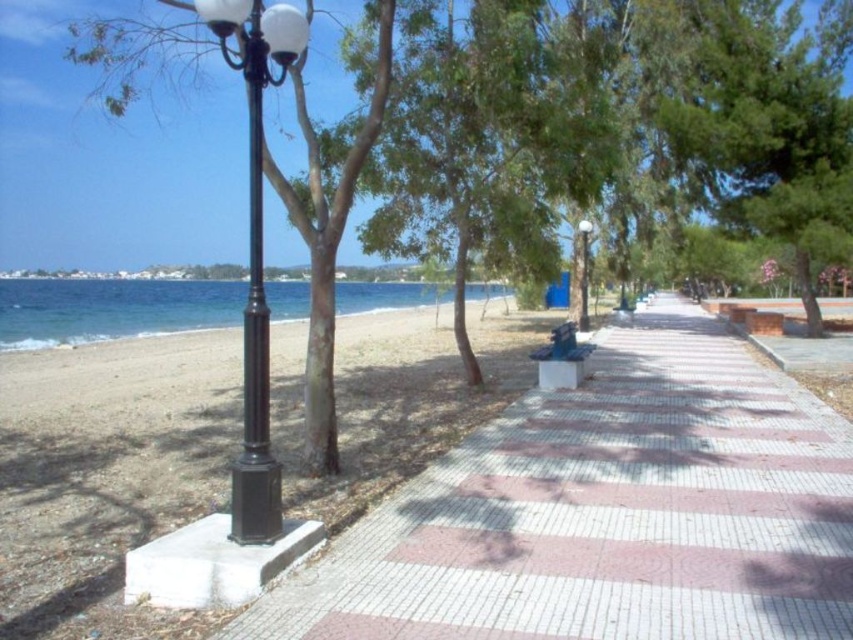
You are walking along the seaside promenade and notice two black objects on the left side of the path. Which one is positioned further to the left between the black polished metal street light at left and the black metal pole at left?

The black polished metal street light at left is positioned further to the left compared to the black metal pole at left, as it is located to the left of the black metal pole at left.

You are standing at the camera position and want to reach point (x=595, y=586) in the image. Is this point closer to you than 6 meters?

The distance of point (x=595, y=586) from camera is 5.06 meters, so yes, the point is closer than 6 meters.

You are a tourist walking along the seaside promenade and want to take a photo of the black metal pole at left without including the white tile pavement at center in the frame. Based on their positions, is this possible?

The white tile pavement at center is in front of the black metal pole at left, so taking a photo of the black metal pole at left without including the white tile pavement at center would require positioning yourself behind the pole to avoid the pavement in the foreground. However, since the pavement is directly in front of the pole from the tourist perspective, it might be challenging to exclude it without moving to a different angle or position.